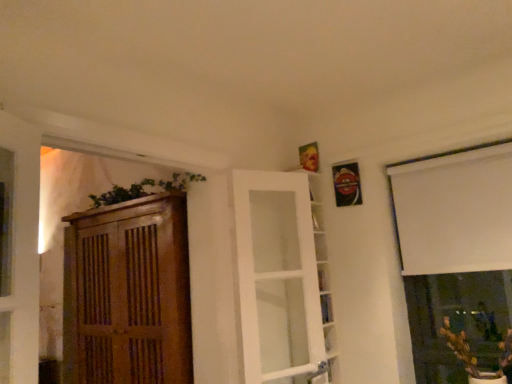
Question: Does white matte window at upper right have a lesser height compared to green matte plant at lower right?

Choices:
 (A) no
 (B) yes

Answer: (A)

Question: Is white matte window at upper right closer to the viewer compared to green matte plant at lower right?

Choices:
 (A) yes
 (B) no

Answer: (B)

Question: Is the position of white matte window at upper right more distant than that of green matte plant at lower right?

Choices:
 (A) no
 (B) yes

Answer: (B)

Question: From the image's perspective, does white matte window at upper right appear higher than green matte plant at lower right?

Choices:
 (A) no
 (B) yes

Answer: (B)

Question: Is white matte window at upper right located outside green matte plant at lower right?

Choices:
 (A) yes
 (B) no

Answer: (A)

Question: Can you confirm if white matte window at upper right is positioned to the right of green matte plant at lower right?

Choices:
 (A) yes
 (B) no

Answer: (A)

Question: Can we say white glass door at center lies outside green matte plant at lower right?

Choices:
 (A) yes
 (B) no

Answer: (A)

Question: Could you tell me if white glass door at center is facing green matte plant at lower right?

Choices:
 (A) yes
 (B) no

Answer: (B)

Question: From a real-world perspective, does white glass door at center sit lower than green matte plant at lower right?

Choices:
 (A) no
 (B) yes

Answer: (A)

Question: Considering the relative positions of white glass door at center and green matte plant at lower right in the image provided, is white glass door at center to the left of green matte plant at lower right from the viewer's perspective?

Choices:
 (A) no
 (B) yes

Answer: (B)

Question: Is white glass door at center wider than green matte plant at lower right?

Choices:
 (A) yes
 (B) no

Answer: (B)

Question: From a real-world perspective, is white glass door at center on top of green matte plant at lower right?

Choices:
 (A) yes
 (B) no

Answer: (A)

Question: Would you say green matte plant at lower right is a long distance from white glass door at center?

Choices:
 (A) no
 (B) yes

Answer: (B)